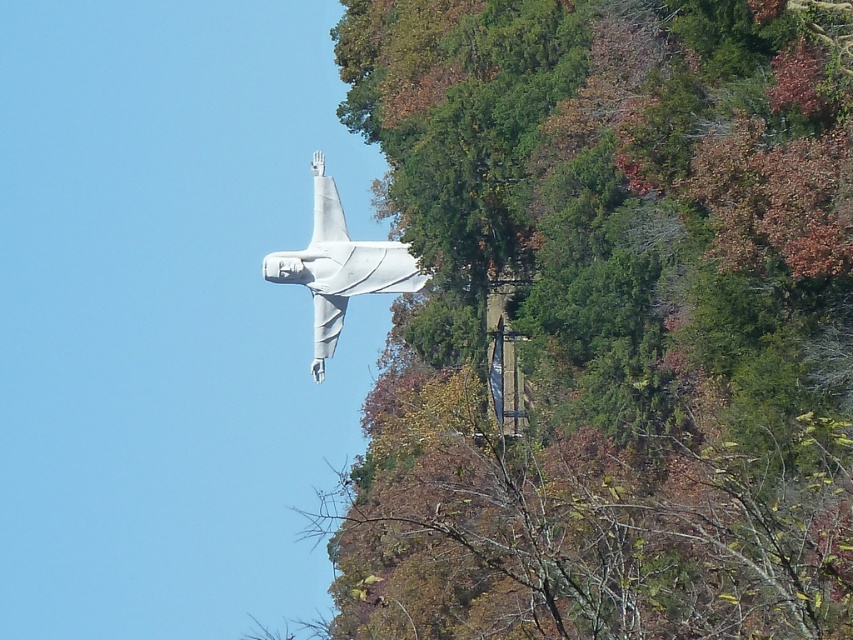
Question: Is the position of green leafy tree at upper center less distant than that of white matte statue at center?

Choices:
 (A) no
 (B) yes

Answer: (B)

Question: Is green leafy tree at upper center to the left of white matte statue at center from the viewer's perspective?

Choices:
 (A) no
 (B) yes

Answer: (A)

Question: Which of the following is the farthest from the observer?

Choices:
 (A) (392, 257)
 (B) (654, 67)

Answer: (A)

Question: Can you confirm if green leafy tree at upper center is smaller than white matte statue at center?

Choices:
 (A) no
 (B) yes

Answer: (A)